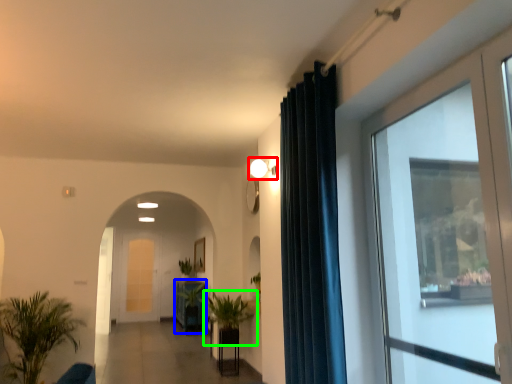
Question: Based on their relative distances, which object is nearer to light fixture (highlighted by a red box)? Choose from furniture (highlighted by a blue box) and houseplant (highlighted by a green box).

Choices:
 (A) furniture
 (B) houseplant

Answer: (B)